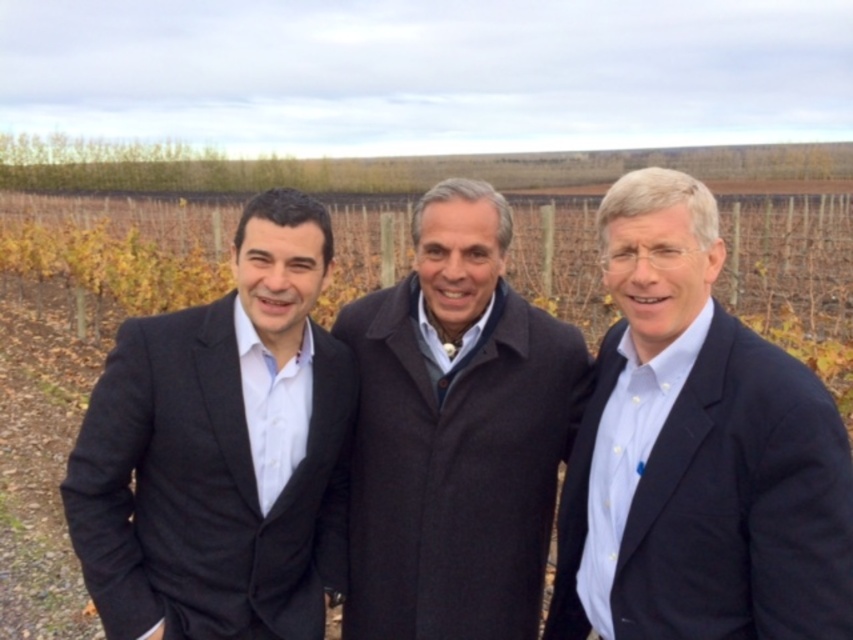
Measure the distance from light blue shirt at center to dark brown wool coat at center.

A distance of 22.45 inches exists between light blue shirt at center and dark brown wool coat at center.

Which is more to the right, light blue shirt at center or dark brown wool coat at center?

Positioned to the right is light blue shirt at center.

Which is behind, point (727, 532) or point (383, 504)?

Point (383, 504)

The image size is (853, 640). I want to click on light blue shirt at center, so click(695, 452).

Can you confirm if light blue shirt at center is bigger than matte black suit at left?

Yes, light blue shirt at center is bigger than matte black suit at left.

Between light blue shirt at center and matte black suit at left, which one is positioned higher?

light blue shirt at center

The height and width of the screenshot is (640, 853). Describe the element at coordinates (695, 452) in the screenshot. I see `light blue shirt at center` at that location.

The width and height of the screenshot is (853, 640). In order to click on light blue shirt at center in this screenshot , I will do click(695, 452).

Can you confirm if matte black suit at left is shorter than dark brown wool coat at center?

Yes, matte black suit at left is shorter than dark brown wool coat at center.

How much distance is there between matte black suit at left and dark brown wool coat at center?

A distance of 49.77 centimeters exists between matte black suit at left and dark brown wool coat at center.

I want to click on matte black suit at left, so click(221, 451).